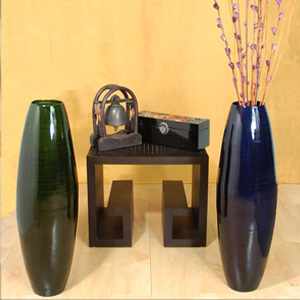
The height and width of the screenshot is (300, 300). I want to click on modern table, so click(127, 159).